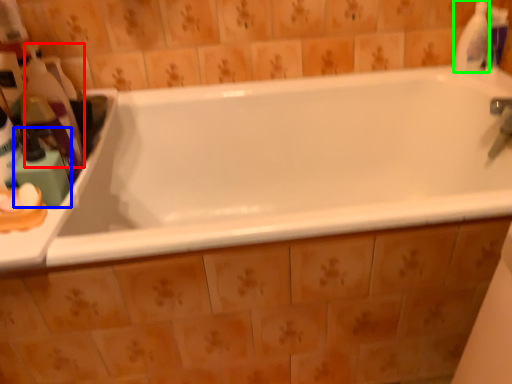
Question: Estimate the real-world distances between objects in this image. Which object is farther from cleaning product (highlighted by a red box), toiletry (highlighted by a blue box) or cleaning product (highlighted by a green box)?

Choices:
 (A) toiletry
 (B) cleaning product

Answer: (B)